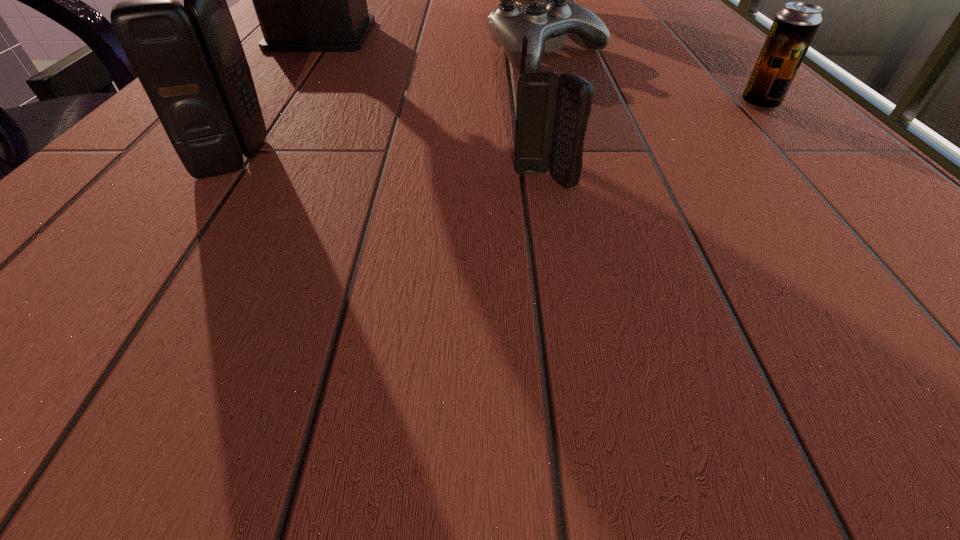
Locate an element on the screen. free space between the shorter cellular telephone and the rightmost object is located at coordinates (652, 143).

At what (x,y) coordinates should I click in order to perform the action: click on free space between the award and the control. Please return your answer as a coordinate pair (x, y). The height and width of the screenshot is (540, 960). Looking at the image, I should click on (435, 45).

This screenshot has height=540, width=960. What are the coordinates of `free area in between the shortest object and the rightmost object` in the screenshot? It's located at (654, 80).

Identify which object is the second nearest to the chalice. Please provide its 2D coordinates. Your answer should be formatted as a tuple, i.e. [(x, y)], where the tuple contains the x and y coordinates of a point satisfying the conditions above.

[(307, 0)]

Find the location of a particular element. This screenshot has width=960, height=540. object identified as the closest to the left cellular telephone is located at coordinates coord(307,0).

Where is `free space that satisfies the following two spatial constraints: 1. on the front-facing side of the second shortest object; 2. on the right side of the tallest object`? The image size is (960, 540). free space that satisfies the following two spatial constraints: 1. on the front-facing side of the second shortest object; 2. on the right side of the tallest object is located at coordinates (271, 104).

You are a GUI agent. You are given a task and a screenshot of the screen. Output one action in this format:
    pyautogui.click(x=<x>, y=<y>)
    Task: Click on the vacant space that satisfies the following two spatial constraints: 1. on the front side of the shortest object; 2. on the keyboard of the taller cellular telephone
    The height and width of the screenshot is (540, 960).
    Given the screenshot: What is the action you would take?
    pyautogui.click(x=579, y=159)